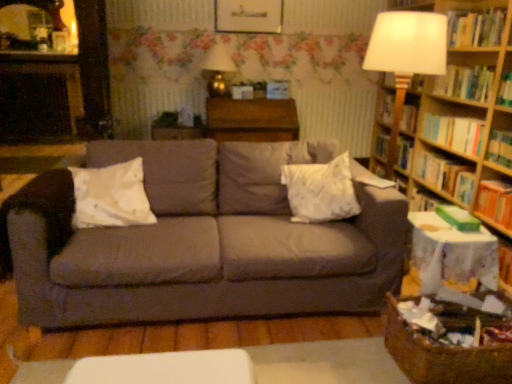
Measure the distance between point (95, 169) and camera.

Point (95, 169) and camera are 2.31 meters apart from each other.

Where is `metallic silver picture frame at upper center`? This screenshot has height=384, width=512. metallic silver picture frame at upper center is located at coordinates (248, 16).

What do you see at coordinates (248, 16) in the screenshot?
I see `metallic silver picture frame at upper center` at bounding box center [248, 16].

Describe the element at coordinates (320, 191) in the screenshot. This screenshot has height=384, width=512. I see `white fabric pillow at center, the first pillow in the right-to-left sequence` at that location.

I want to click on orange hardcover book at right, marked as the sixth book in a top-to-bottom arrangement, so click(x=495, y=202).

Where is `white soft pillow at left, placed as the second pillow when sorted from right to left`? This screenshot has height=384, width=512. white soft pillow at left, placed as the second pillow when sorted from right to left is located at coordinates (111, 196).

Can you confirm if metallic gold table lamp at upper center is taller than hardcover book at upper right, which is the fifth book in bottom-to-top order?

Correct, metallic gold table lamp at upper center is much taller as hardcover book at upper right, which is the fifth book in bottom-to-top order.

Does metallic gold table lamp at upper center have a lesser width compared to hardcover book at upper right, which is the fifth book in bottom-to-top order?

No, metallic gold table lamp at upper center is not thinner than hardcover book at upper right, which is the fifth book in bottom-to-top order.

Is metallic gold table lamp at upper center positioned with its back to hardcover book at upper right, the second book viewed from the top?

metallic gold table lamp at upper center is not turned away from hardcover book at upper right, the second book viewed from the top.

How distant is metallic gold table lamp at upper center from hardcover book at upper right, the second book viewed from the top?

The distance of metallic gold table lamp at upper center from hardcover book at upper right, the second book viewed from the top, is 1.80 meters.

Identify the location of picture frame located above the hardcover book at right, the 2th book positioned from the bottom (from the image's perspective). (248, 16).

Can you confirm if hardcover book at right, the 2th book positioned from the bottom, is bigger than metallic silver picture frame at upper center?

Yes.

Is hardcover book at right, the 2th book positioned from the bottom, at the right side of metallic silver picture frame at upper center?

Correct, you'll find hardcover book at right, the 2th book positioned from the bottom, to the right of metallic silver picture frame at upper center.

Image resolution: width=512 pixels, height=384 pixels. I want to click on bookcase that is in front of the hardcover book at right, the 2th book positioned from the bottom, so click(455, 111).

Considering the positions of objects hardcover book at right, the 2th book positioned from the bottom, and wooden bookshelf at right in the image provided, who is more to the left, hardcover book at right, the 2th book positioned from the bottom, or wooden bookshelf at right?

From the viewer's perspective, hardcover book at right, the 2th book positioned from the bottom, appears more on the left side.

Can you see hardcover book at right, the 2th book positioned from the bottom, touching wooden bookshelf at right?

hardcover book at right, the 2th book positioned from the bottom, is not next to wooden bookshelf at right, and they're not touching.

Can you confirm if hardcover book at right, the fifth book viewed from the top, is shorter than wooden bookshelf at right?

Correct, hardcover book at right, the fifth book viewed from the top, is not as tall as wooden bookshelf at right.

From a real-world perspective, between wooden bookshelf at right and white soft pillow at left, placed as the second pillow when sorted from right to left, who is vertically lower?

white soft pillow at left, placed as the second pillow when sorted from right to left.

Would you say wooden bookshelf at right is inside or outside white soft pillow at left, placed as the second pillow when sorted from right to left?

wooden bookshelf at right is spatially situated outside white soft pillow at left, placed as the second pillow when sorted from right to left.

How many degrees apart are the facing directions of wooden bookshelf at right and white soft pillow at left, placed as the 1th pillow when sorted from left to right?

They differ by 88.8 degrees in their facing directions.

Considering the relative sizes of wooden bookshelf at right and white soft pillow at left, placed as the 1th pillow when sorted from left to right, in the image provided, is wooden bookshelf at right wider than white soft pillow at left, placed as the 1th pillow when sorted from left to right,?

In fact, wooden bookshelf at right might be narrower than white soft pillow at left, placed as the 1th pillow when sorted from left to right.

In the scene shown: Is hardcover book at upper right, which is the fifth book in bottom-to-top order, aimed at wooden bookshelf at right?

Yes, hardcover book at upper right, which is the fifth book in bottom-to-top order, is aimed at wooden bookshelf at right.

Which is more to the left, hardcover book at upper right, the second book viewed from the top, or wooden bookshelf at right?

From the viewer's perspective, wooden bookshelf at right appears more on the left side.

Is hardcover book at upper right, the second book viewed from the top, behind wooden bookshelf at right?

Yes, hardcover book at upper right, the second book viewed from the top, is behind wooden bookshelf at right.

Is hardcover book at upper right, the second book viewed from the top, inside or outside of wooden bookshelf at right?

hardcover book at upper right, the second book viewed from the top, is contained in wooden bookshelf at right.

Is white fabric pillow at center, the first pillow in the right-to-left sequence, with green matte paperback book at right?

They are not placed beside each other.

From a real-world perspective, does white fabric pillow at center, the first pillow in the right-to-left sequence, sit lower than green matte paperback book at right?

No, from a real-world perspective, white fabric pillow at center, the first pillow in the right-to-left sequence, is not under green matte paperback book at right.

Does white fabric pillow at center, the 2th pillow viewed from the left, contain green matte paperback book at right?

That's incorrect, green matte paperback book at right is not inside white fabric pillow at center, the 2th pillow viewed from the left.

Is white fabric pillow at center, the first pillow in the right-to-left sequence, facing away from green matte paperback book at right?

white fabric pillow at center, the first pillow in the right-to-left sequence, does not have its back to green matte paperback book at right.

Which pillow is the 2nd one when counting from the front of the hardcover book at upper right, which is the fifth book in bottom-to-top order? Please provide its 2D coordinates.

[(111, 196)]

From the image's perspective, is hardcover book at upper right, which is the fifth book in bottom-to-top order, over white soft pillow at left, placed as the second pillow when sorted from right to left?

Yes, from the image's perspective, hardcover book at upper right, which is the fifth book in bottom-to-top order, is above white soft pillow at left, placed as the second pillow when sorted from right to left.

Is hardcover book at upper right, the second book viewed from the top, oriented towards white soft pillow at left, placed as the 1th pillow when sorted from left to right?

No, hardcover book at upper right, the second book viewed from the top, is not turned towards white soft pillow at left, placed as the 1th pillow when sorted from left to right.

Based on the photo, is hardcover book at upper right, which is the fifth book in bottom-to-top order, inside the boundaries of white soft pillow at left, placed as the second pillow when sorted from right to left, or outside?

hardcover book at upper right, which is the fifth book in bottom-to-top order, lies outside white soft pillow at left, placed as the second pillow when sorted from right to left.

Find the location of a particular element. The height and width of the screenshot is (384, 512). table lamp that is on the left side of hardcover book at upper right, which is the fifth book in bottom-to-top order is located at coordinates (218, 70).

The width and height of the screenshot is (512, 384). In order to click on picture frame located above the hardcover book at right, the 2th book positioned from the bottom (from a real-world perspective) in this screenshot , I will do `click(248, 16)`.

When comparing their distances from hardcover book at right, the fifth book viewed from the top, does wooden table at center or wooden bookshelf at right seem further?

wooden table at center.

When comparing their distances from wooden bookshelf at right, does hardcover book at right, which ranks as the 3th book in bottom-to-top order, or white fabric pillow at center, the 2th pillow viewed from the left, seem further?

white fabric pillow at center, the 2th pillow viewed from the left, lies further to wooden bookshelf at right than the other object.

Looking at this image, from the image, which object appears to be farther from white fabric pillow at center, the 2th pillow viewed from the left, white soft pillow at left, placed as the 1th pillow when sorted from left to right, or hardcover book at right, the 2th book positioned from the bottom?

hardcover book at right, the 2th book positioned from the bottom, is further to white fabric pillow at center, the 2th pillow viewed from the left.

When comparing their distances from hardcover book at upper right, which is the fifth book in bottom-to-top order, does orange hardcover book at right, marked as the 1th book in a bottom-to-top arrangement, or white fabric pillow at center, the first pillow in the right-to-left sequence, seem closer?

orange hardcover book at right, marked as the 1th book in a bottom-to-top arrangement, is closer to hardcover book at upper right, which is the fifth book in bottom-to-top order.

Estimate the real-world distances between objects in this image. Which object is further from white soft pillow at left, placed as the second pillow when sorted from right to left, wooden bookshelf at right or wooden table at center?

Based on the image, wooden bookshelf at right appears to be further to white soft pillow at left, placed as the second pillow when sorted from right to left.

Estimate the real-world distances between objects in this image. Which object is further from metallic gold table lamp at upper center, wooden bookshelf at right or orange hardcover book at right, marked as the 1th book in a bottom-to-top arrangement?

The object further to metallic gold table lamp at upper center is orange hardcover book at right, marked as the 1th book in a bottom-to-top arrangement.

When comparing their distances from metallic gold table lamp at upper center, does gray fabric couch at center or hardcover book at upper right, which is the fifth book in bottom-to-top order, seem further?

The object further to metallic gold table lamp at upper center is hardcover book at upper right, which is the fifth book in bottom-to-top order.

Estimate the real-world distances between objects in this image. Which object is further from white fabric pillow at center, the 2th pillow viewed from the left, hardcover book at right, the fifth book viewed from the top, or white soft pillow at left, placed as the 1th pillow when sorted from left to right?

hardcover book at right, the fifth book viewed from the top, is further to white fabric pillow at center, the 2th pillow viewed from the left.

Identify the location of bookcase between white soft pillow at left, placed as the second pillow when sorted from right to left, and orange hardcover book at right, marked as the sixth book in a top-to-bottom arrangement. (455, 111).

Image resolution: width=512 pixels, height=384 pixels. In order to click on book located between metallic silver picture frame at upper center and hardcover book at right, the 2th book positioned from the bottom, in the left-right direction in this screenshot , I will do `click(386, 109)`.

Where is `pillow positioned between white soft pillow at left, placed as the 1th pillow when sorted from left to right, and wooden table at center from near to far`? The width and height of the screenshot is (512, 384). pillow positioned between white soft pillow at left, placed as the 1th pillow when sorted from left to right, and wooden table at center from near to far is located at coordinates (320, 191).

Where is `pillow located between wooden table at center and hardcover book at upper right, which is the first book from top to bottom, in the left-right direction`? The height and width of the screenshot is (384, 512). pillow located between wooden table at center and hardcover book at upper right, which is the first book from top to bottom, in the left-right direction is located at coordinates (320, 191).